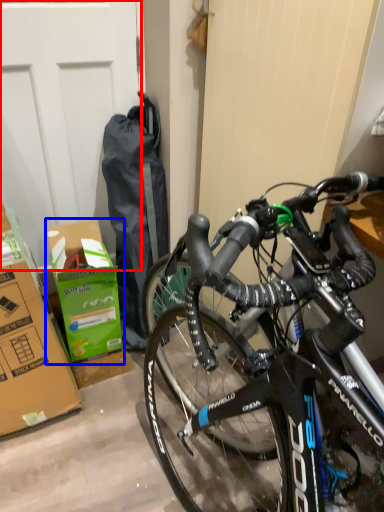
Question: Among these objects, which one is farthest to the camera, garage door (highlighted by a red box) or cardboard box (highlighted by a blue box)?

Choices:
 (A) garage door
 (B) cardboard box

Answer: (B)